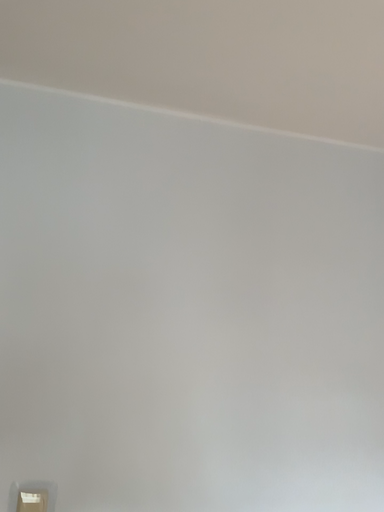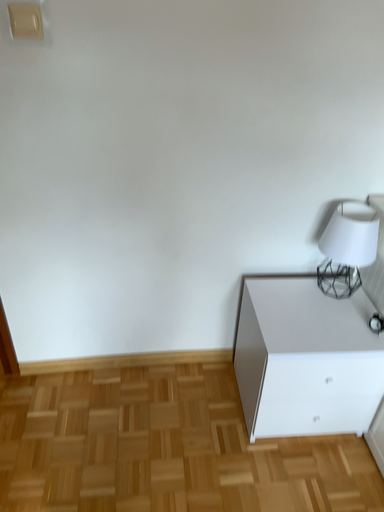
Question: Which way did the camera rotate in the video?

Choices:
 (A) rotated left
 (B) rotated right

Answer: (A)